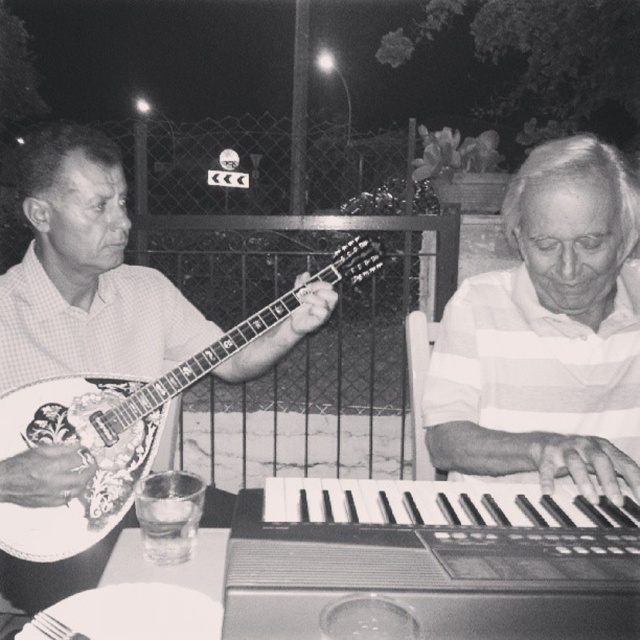
Does white striped shirt at right have a smaller size compared to decorative wood mandolin at left?

Yes.

Does white striped shirt at right lie in front of decorative wood mandolin at left?

A: Yes, white striped shirt at right is closer to the viewer.

This screenshot has width=640, height=640. I want to click on white striped shirt at right, so click(x=547, y=333).